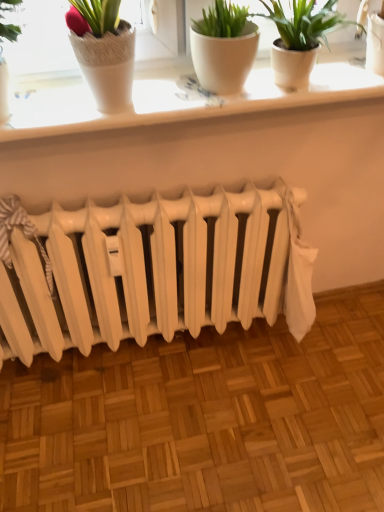
Question: In terms of height, does white ceramic window sill at upper center look taller or shorter compared to white matte flowerpot at upper center?

Choices:
 (A) short
 (B) tall

Answer: (A)

Question: From a real-world perspective, relative to white matte flowerpot at upper center, is white ceramic window sill at upper center vertically above or below?

Choices:
 (A) below
 (B) above

Answer: (A)

Question: Based on their relative distances, which object is farther from the white matte flowerpot at upper center?

Choices:
 (A) white ceramic window sill at upper center
 (B) white matte radiator at center

Answer: (B)

Question: Estimate the real-world distances between objects in this image. Which object is closer to the white ceramic window sill at upper center?

Choices:
 (A) white matte flowerpot at upper center
 (B) white matte radiator at center

Answer: (A)